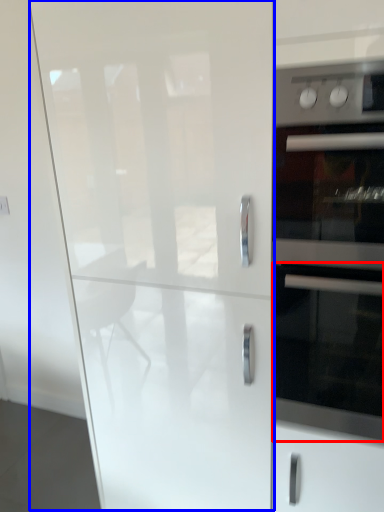
Question: Which object appears closest to the camera in this image, oven (highlighted by a red box) or glass door (highlighted by a blue box)?

Choices:
 (A) oven
 (B) glass door

Answer: (B)